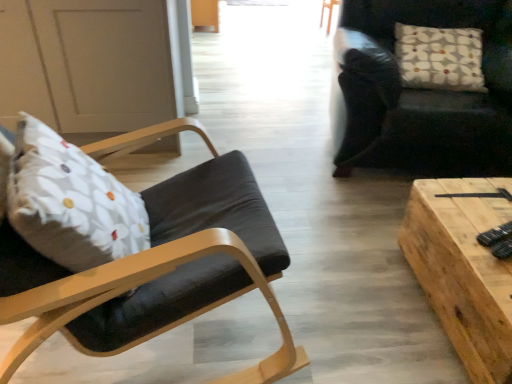
Question: From the image's perspective, is matte black chair at left, the 1th chair in the front-to-back sequence, below dark leather chair at upper right, the second chair positioned from the front?

Choices:
 (A) no
 (B) yes

Answer: (B)

Question: Is matte black chair at left, the 2th chair when ordered from right to left, smaller than dark leather chair at upper right, which ranks as the second chair in left-to-right order?

Choices:
 (A) yes
 (B) no

Answer: (A)

Question: Considering the relative sizes of matte black chair at left, the first chair viewed from the left, and dark leather chair at upper right, which ranks as the second chair in left-to-right order, in the image provided, is matte black chair at left, the first chair viewed from the left, taller than dark leather chair at upper right, which ranks as the second chair in left-to-right order,?

Choices:
 (A) yes
 (B) no

Answer: (A)

Question: From the image's perspective, is matte black chair at left, the first chair viewed from the left, on top of dark leather chair at upper right, the second chair positioned from the front?

Choices:
 (A) no
 (B) yes

Answer: (A)

Question: Is matte black chair at left, the 2th chair when ordered from right to left, behind dark leather chair at upper right, the second chair positioned from the front?

Choices:
 (A) yes
 (B) no

Answer: (B)

Question: Considering the positions of white floral fabric pillow at upper right and dark leather chair at upper right, arranged as the 1th chair when viewed from the right, in the image, is white floral fabric pillow at upper right bigger or smaller than dark leather chair at upper right, arranged as the 1th chair when viewed from the right,?

Choices:
 (A) big
 (B) small

Answer: (B)

Question: Considering the relative positions of white floral fabric pillow at upper right and dark leather chair at upper right, the second chair positioned from the front, in the image provided, is white floral fabric pillow at upper right to the left or to the right of dark leather chair at upper right, the second chair positioned from the front,?

Choices:
 (A) right
 (B) left

Answer: (A)

Question: From their relative heights in the image, would you say white floral fabric pillow at upper right is taller or shorter than dark leather chair at upper right, the 1th chair from the back?

Choices:
 (A) tall
 (B) short

Answer: (B)

Question: From a real-world perspective, is white floral fabric pillow at upper right positioned above or below dark leather chair at upper right, the 1th chair from the back?

Choices:
 (A) below
 (B) above

Answer: (B)

Question: Is wooden plank table at center wider or thinner than white floral fabric pillow at upper right?

Choices:
 (A) thin
 (B) wide

Answer: (B)

Question: Considering the relative positions of wooden plank table at center and white floral fabric pillow at upper right in the image provided, is wooden plank table at center to the left or to the right of white floral fabric pillow at upper right?

Choices:
 (A) left
 (B) right

Answer: (A)

Question: From a real-world perspective, is wooden plank table at center above or below white floral fabric pillow at upper right?

Choices:
 (A) above
 (B) below

Answer: (B)

Question: From the image's perspective, is wooden plank table at center above or below white floral fabric pillow at upper right?

Choices:
 (A) above
 (B) below

Answer: (B)

Question: In terms of size, does black plastic remote control at lower right appear bigger or smaller than wooden plank table at center?

Choices:
 (A) big
 (B) small

Answer: (B)

Question: From the image's perspective, is black plastic remote control at lower right located above or below wooden plank table at center?

Choices:
 (A) above
 (B) below

Answer: (A)